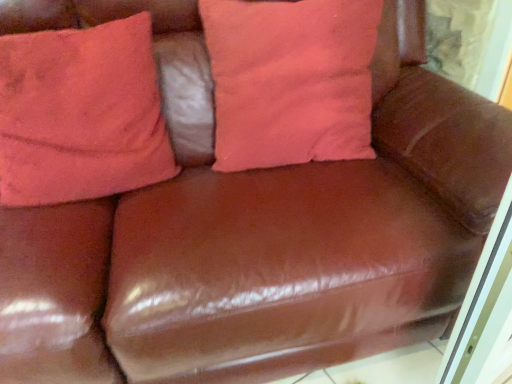
Question: Based on their sizes in the image, would you say pink cotton pillow at center, the 2th pillow in the left-to-right sequence, is bigger or smaller than coral fabric pillow at upper left, which is the 1th pillow from left to right?

Choices:
 (A) small
 (B) big

Answer: (B)

Question: Considering their positions, is pink cotton pillow at center, the 2th pillow in the left-to-right sequence, located in front of or behind coral fabric pillow at upper left, marked as the 2th pillow in a right-to-left arrangement?

Choices:
 (A) front
 (B) behind

Answer: (B)

Question: Do you think pink cotton pillow at center, arranged as the first pillow when viewed from the right, is within coral fabric pillow at upper left, which is the 1th pillow from left to right, or outside of it?

Choices:
 (A) inside
 (B) outside

Answer: (B)

Question: From a real-world perspective, is coral fabric pillow at upper left, which is the 1th pillow from left to right, above or below pink cotton pillow at center, arranged as the first pillow when viewed from the right?

Choices:
 (A) below
 (B) above

Answer: (B)

Question: Considering the positions of coral fabric pillow at upper left, which is the 1th pillow from left to right, and pink cotton pillow at center, arranged as the first pillow when viewed from the right, in the image, is coral fabric pillow at upper left, which is the 1th pillow from left to right, wider or thinner than pink cotton pillow at center, arranged as the first pillow when viewed from the right,?

Choices:
 (A) thin
 (B) wide

Answer: (A)

Question: Is point (0, 140) positioned closer to the camera than point (311, 102)?

Choices:
 (A) farther
 (B) closer

Answer: (B)

Question: Based on their sizes in the image, would you say coral fabric pillow at upper left, which is the 1th pillow from left to right, is bigger or smaller than pink cotton pillow at center, arranged as the first pillow when viewed from the right?

Choices:
 (A) big
 (B) small

Answer: (B)